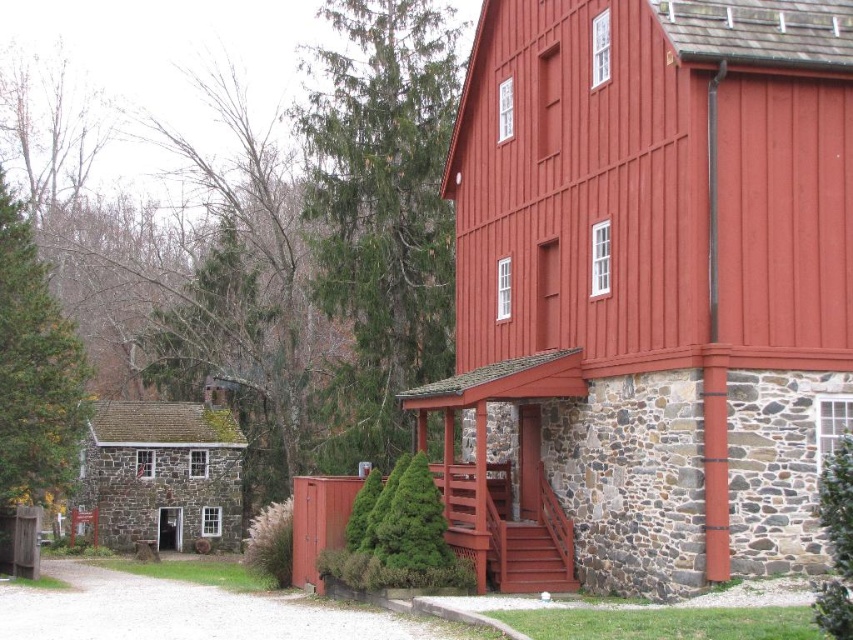
Identify the location of green textured tree at upper center. (380, 211).

Which is above, green textured tree at upper center or green leafy tree at center-right?

green textured tree at upper center is above.

This screenshot has height=640, width=853. I want to click on green textured tree at upper center, so click(380, 211).

At what (x,y) coordinates should I click in order to perform the action: click on green textured tree at upper center. Please return your answer as a coordinate pair (x, y). Looking at the image, I should click on (380, 211).

Does green textured tree at upper center have a greater width compared to smooth wooden stairs at center?

Indeed, green textured tree at upper center has a greater width compared to smooth wooden stairs at center.

Identify the location of green textured tree at upper center. The image size is (853, 640). (380, 211).

Is smooth wooden barn at center bigger than green textured pine tree at left?

Actually, smooth wooden barn at center might be smaller than green textured pine tree at left.

Can you confirm if smooth wooden barn at center is positioned below green textured pine tree at left?

Incorrect, smooth wooden barn at center is not positioned below green textured pine tree at left.

You are a GUI agent. You are given a task and a screenshot of the screen. Output one action in this format:
    pyautogui.click(x=<x>, y=<y>)
    Task: Click on the smooth wooden barn at center
    
    Given the screenshot: What is the action you would take?
    pyautogui.click(x=653, y=278)